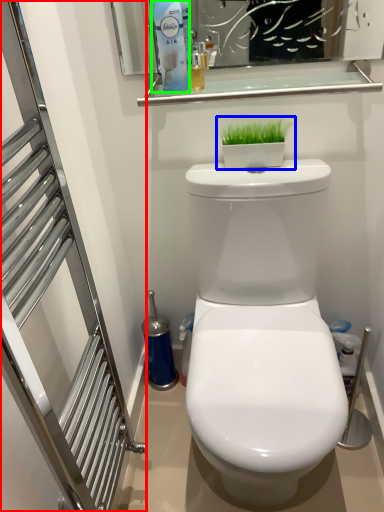
Question: Estimate the real-world distances between objects in this image. Which object is farther from screen door (highlighted by a red box), houseplant (highlighted by a blue box) or cleaning product (highlighted by a green box)?

Choices:
 (A) houseplant
 (B) cleaning product

Answer: (A)